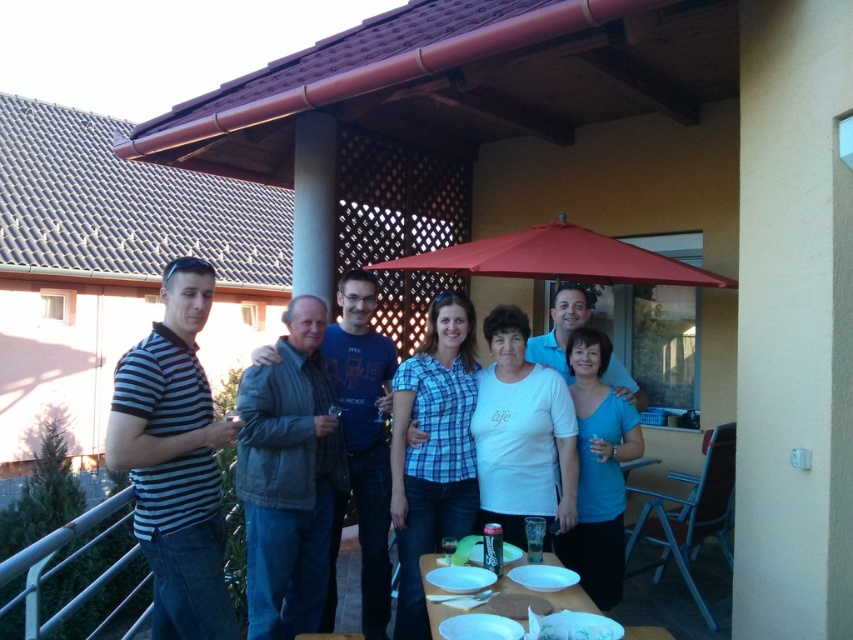
You are a photographer standing at the edge of the balcony, and you want to capture a photo of the denim jacket at center and the table at bottom right. How far apart are these two objects in meters?

The denim jacket at center and the table at bottom right are 3.03 meters apart.

You are a photographer trying to focus on the white cotton shirt at center in the image. Given that the camera is focused on the point at coordinates point (521, 435), can you confirm if the white cotton shirt at center is within the focus area?

The point (521, 435) indicates the white cotton shirt at center, so yes, the white cotton shirt at center is within the focus area.

You are a photographer trying to capture the perfect shot of the denim jacket at center. The camera you are using has a focus point set at coordinate point [288,477]. Will the denim jacket at center be in focus?

Yes, the denim jacket at center is located at point [288,477], so the focus point is directly on it, ensuring it will be in focus.